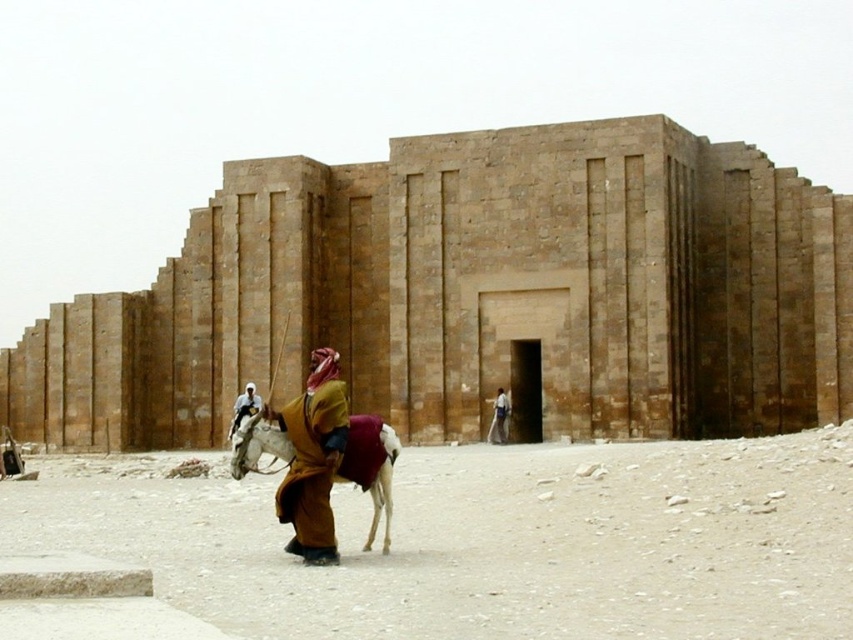
Question: Among these points, which one is farthest from the camera?

Choices:
 (A) (242, 401)
 (B) (492, 433)
 (C) (276, 452)
 (D) (296, 452)

Answer: (A)

Question: Which point is closer to the camera taking this photo?

Choices:
 (A) (323, 472)
 (B) (389, 506)

Answer: (A)

Question: Does brown woolen robe at center have a smaller size compared to light brown leather jacket at center?

Choices:
 (A) yes
 (B) no

Answer: (B)

Question: Which of the following is the closest to the observer?

Choices:
 (A) (234, 404)
 (B) (495, 408)
 (C) (360, 451)
 (D) (315, 531)

Answer: (D)

Question: Can you confirm if brown woolen robe at center is positioned to the right of light brown leather jacket at center?

Choices:
 (A) yes
 (B) no

Answer: (A)

Question: Is brown leather jacket at center thinner than light brown leather jacket at center?

Choices:
 (A) yes
 (B) no

Answer: (A)